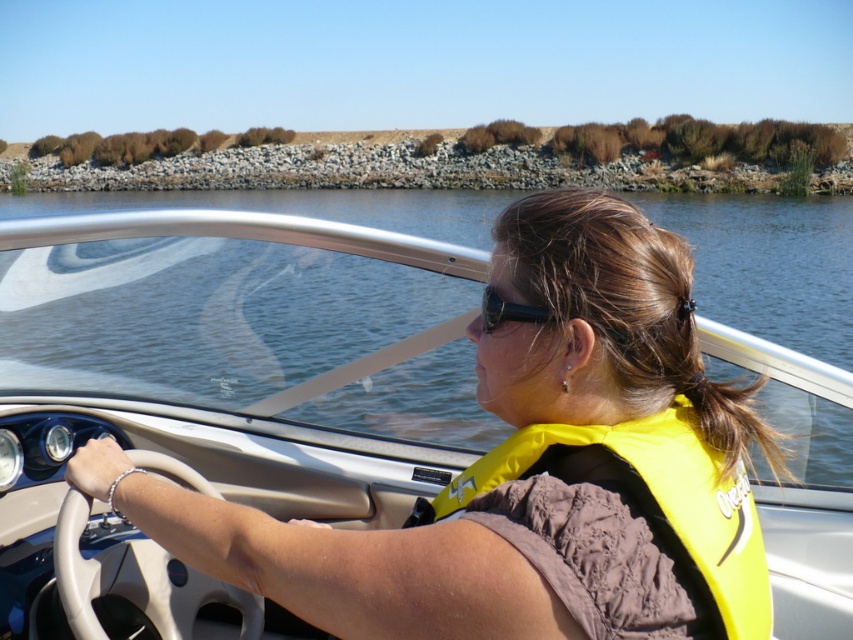
You are a passenger in the boat and want to grab the black plastic sunglasses at upper center. To reach them, you need to move your hand from the white leather steering wheel at center. In which direction should you move your hand?

The white leather steering wheel at center is to the left of the black plastic sunglasses at upper center, so you should move your hand to the right to reach the black plastic sunglasses at upper center.

You are a safety inspector checking the boat for proper equipment placement. According to regulations, the steering wheel must be positioned so that it does not obstruct the driver from seeing their sunglasses. Given the sizes of the matte white steering wheel at center and the black plastic sunglasses at upper center, is there a potential obstruction issue?

The matte white steering wheel at center is wider than the black plastic sunglasses at upper center. Since the steering wheel is larger in width, it could potentially block the driver from seeing their sunglasses if positioned directly in front, creating an obstruction issue.

You are a passenger in the boat and want to look at the dashboard controls. Which object is closer to the center of the dashboard between the matte white steering wheel at center and the black plastic sunglasses at upper center?

The matte white steering wheel at center is positioned on the left side of the black plastic sunglasses at upper center, so the steering wheel is closer to the center of the dashboard.